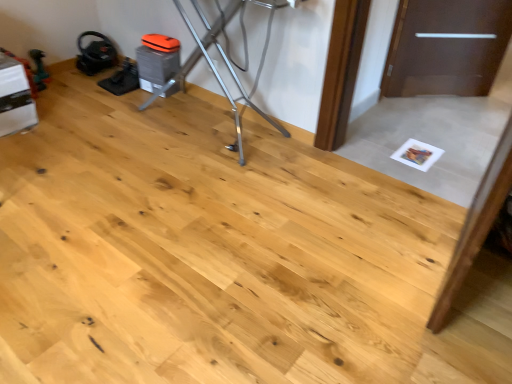
Identify the location of brown matte door at upper right. (446, 47).

Image resolution: width=512 pixels, height=384 pixels. Describe the element at coordinates (446, 47) in the screenshot. I see `brown matte door at upper right` at that location.

Image resolution: width=512 pixels, height=384 pixels. What do you see at coordinates (215, 69) in the screenshot?
I see `metallic silver ironing board at upper center` at bounding box center [215, 69].

At what (x,y) coordinates should I click in order to perform the action: click on metallic silver ironing board at upper center. Please return your answer as a coordinate pair (x, y). The height and width of the screenshot is (384, 512). Looking at the image, I should click on (215, 69).

Image resolution: width=512 pixels, height=384 pixels. Find the location of `brown matte door at upper right`. brown matte door at upper right is located at coordinates (446, 47).

Can you confirm if metallic silver ironing board at upper center is positioned to the left of brown matte door at upper right?

Yes.

Is metallic silver ironing board at upper center behind brown matte door at upper right?

No, metallic silver ironing board at upper center is closer to the camera.

Does point (215, 76) appear closer or farther from the camera than point (501, 7)?

Point (215, 76) appears to be closer to the viewer than point (501, 7).

In the scene shown: From the image's perspective, who appears lower, metallic silver ironing board at upper center or brown matte door at upper right?

metallic silver ironing board at upper center appears lower in the image.

From a real-world perspective, is metallic silver ironing board at upper center positioned over brown matte door at upper right based on gravity?

Yes, from a real-world perspective, metallic silver ironing board at upper center is above brown matte door at upper right.

Which of these two, metallic silver ironing board at upper center or brown matte door at upper right, is thinner?

brown matte door at upper right is thinner.

Considering the relative sizes of metallic silver ironing board at upper center and brown matte door at upper right in the image provided, is metallic silver ironing board at upper center shorter than brown matte door at upper right?

No.

Based on their sizes in the image, would you say metallic silver ironing board at upper center is bigger or smaller than brown matte door at upper right?

metallic silver ironing board at upper center is bigger than brown matte door at upper right.

Is brown matte door at upper right located within metallic silver ironing board at upper center?

Definitely not — brown matte door at upper right is not inside metallic silver ironing board at upper center.

Is metallic silver ironing board at upper center not near brown matte door at upper right?

Yes, metallic silver ironing board at upper center and brown matte door at upper right are quite far apart.

Is metallic silver ironing board at upper center oriented towards brown matte door at upper right?

No, metallic silver ironing board at upper center is not oriented towards brown matte door at upper right.

Image resolution: width=512 pixels, height=384 pixels. Find the location of `door that is under the metallic silver ironing board at upper center (from a real-world perspective)`. door that is under the metallic silver ironing board at upper center (from a real-world perspective) is located at coordinates (446, 47).

Can you confirm if brown matte door at upper right is positioned to the right of metallic silver ironing board at upper center?

Yes.

Is brown matte door at upper right closer to camera compared to metallic silver ironing board at upper center?

No, it is behind metallic silver ironing board at upper center.

Is point (467, 23) positioned in front of point (261, 116)?

No, it is not.

From the image's perspective, is brown matte door at upper right on metallic silver ironing board at upper center?

Yes, from the image's perspective, brown matte door at upper right is over metallic silver ironing board at upper center.

From a real-world perspective, is brown matte door at upper right physically located above or below metallic silver ironing board at upper center?

From a real-world perspective, brown matte door at upper right is physically below metallic silver ironing board at upper center.

Which object is wider, brown matte door at upper right or metallic silver ironing board at upper center?

With larger width is metallic silver ironing board at upper center.

Can you confirm if brown matte door at upper right is shorter than metallic silver ironing board at upper center?

Yes, brown matte door at upper right is shorter than metallic silver ironing board at upper center.

Considering the sizes of brown matte door at upper right and metallic silver ironing board at upper center in the image, is brown matte door at upper right bigger or smaller than metallic silver ironing board at upper center?

brown matte door at upper right is smaller than metallic silver ironing board at upper center.

Is brown matte door at upper right inside the boundaries of metallic silver ironing board at upper center, or outside?

brown matte door at upper right cannot be found inside metallic silver ironing board at upper center.

Consider the image. Does brown matte door at upper right touch metallic silver ironing board at upper center?

No, brown matte door at upper right is not next to metallic silver ironing board at upper center.

Is metallic silver ironing board at upper center at the back of brown matte door at upper right?

No, brown matte door at upper right is not facing the opposite direction of metallic silver ironing board at upper center.

How different are the orientations of brown matte door at upper right and metallic silver ironing board at upper center in degrees?

brown matte door at upper right and metallic silver ironing board at upper center are facing 46.6 degrees away from each other.

At what (x,y) coordinates should I click in order to perform the action: click on door that appears below the metallic silver ironing board at upper center (from a real-world perspective). Please return your answer as a coordinate pair (x, y). Looking at the image, I should click on (446, 47).

Locate an element on the screen. Image resolution: width=512 pixels, height=384 pixels. furniture on the left of brown matte door at upper right is located at coordinates (215, 69).

Locate an element on the screen. door that appears below the metallic silver ironing board at upper center (from a real-world perspective) is located at coordinates (446, 47).